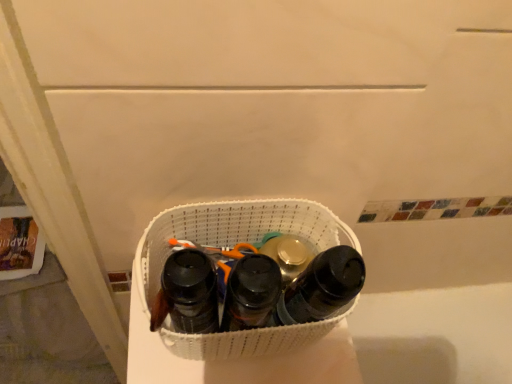
In order to face black matte water bottle at center, the 3th footwear positioned from the right, should I rotate leftwards or rightwards?

A 8.080 degree turn to the left will do.

Find the location of `black matte bottle at center, the first footwear in the right-to-left sequence`. black matte bottle at center, the first footwear in the right-to-left sequence is located at coordinates (322, 287).

How many degrees apart are the facing directions of white woven laundry basket at center and black matte water bottle at center, the first footwear when ordered from left to right?

The angle between the facing direction of white woven laundry basket at center and the facing direction of black matte water bottle at center, the first footwear when ordered from left to right, is 0.00305 degrees.

Does white woven laundry basket at center have a greater width compared to black matte water bottle at center, the first footwear when ordered from left to right?

Yes.

Is point (214, 351) in front of point (205, 298)?

No, it is not.

Is white woven laundry basket at center far from black matte water bottle at center, the 3th footwear positioned from the right?

No, white woven laundry basket at center is not far away from black matte water bottle at center, the 3th footwear positioned from the right.

Which point is more distant from viewer, (253, 274) or (328, 286)?

The point (328, 286) is more distant.

Is black matte shoe at center, the 2th footwear viewed from the right, looking in the opposite direction of black matte bottle at center, the first footwear in the right-to-left sequence?

No, black matte bottle at center, the first footwear in the right-to-left sequence, is not at the back of black matte shoe at center, the 2th footwear viewed from the right.

Where is `footwear that is the 2nd one when counting upward from the black matte shoe at center, which is the second footwear in left-to-right order (from the image's perspective)`? footwear that is the 2nd one when counting upward from the black matte shoe at center, which is the second footwear in left-to-right order (from the image's perspective) is located at coordinates (322, 287).

Which object is thinner, black matte shoe at center, which is the second footwear in left-to-right order, or black matte bottle at center, which is the 3th footwear from left to right?

With smaller width is black matte bottle at center, which is the 3th footwear from left to right.

Is black matte water bottle at center, the first footwear when ordered from left to right, bigger or smaller than white woven laundry basket at center?

black matte water bottle at center, the first footwear when ordered from left to right, is smaller than white woven laundry basket at center.

Is black matte water bottle at center, the 3th footwear positioned from the right, in front of or behind white woven laundry basket at center in the image?

In the image, black matte water bottle at center, the 3th footwear positioned from the right, appears in front of white woven laundry basket at center.

From a real-world perspective, starting from the white woven laundry basket at center, which footwear is the 1st one vertically above it? Please provide its 2D coordinates.

[(190, 292)]

From the image's perspective, is black matte water bottle at center, the 3th footwear positioned from the right, above white woven laundry basket at center?

No, from the image's perspective, black matte water bottle at center, the 3th footwear positioned from the right, is not above white woven laundry basket at center.

Is black matte water bottle at center, the 3th footwear positioned from the right, completely or partially outside of black matte shoe at center, which is the second footwear in left-to-right order?

That's correct, black matte water bottle at center, the 3th footwear positioned from the right, is outside of black matte shoe at center, which is the second footwear in left-to-right order.

This screenshot has width=512, height=384. Find the location of `the 1st footwear behind the black matte water bottle at center, the first footwear when ordered from left to right, starting your count from the anchor`. the 1st footwear behind the black matte water bottle at center, the first footwear when ordered from left to right, starting your count from the anchor is located at coordinates (251, 292).

Which is further, (168, 257) or (261, 287)?

The point (168, 257) is more distant.

Considering the sizes of objects black matte water bottle at center, the first footwear when ordered from left to right, and black matte shoe at center, the 2th footwear viewed from the right, in the image provided, who is bigger, black matte water bottle at center, the first footwear when ordered from left to right, or black matte shoe at center, the 2th footwear viewed from the right,?

With larger size is black matte shoe at center, the 2th footwear viewed from the right.

Where is `footwear that is the 2nd object located in front of the white woven laundry basket at center`? footwear that is the 2nd object located in front of the white woven laundry basket at center is located at coordinates (251, 292).

Considering the relative sizes of white woven laundry basket at center and black matte shoe at center, the 2th footwear viewed from the right, in the image provided, is white woven laundry basket at center shorter than black matte shoe at center, the 2th footwear viewed from the right,?

Correct, white woven laundry basket at center is not as tall as black matte shoe at center, the 2th footwear viewed from the right.

From the image's perspective, relative to black matte shoe at center, which is the second footwear in left-to-right order, is white woven laundry basket at center above or below?

white woven laundry basket at center is situated higher than black matte shoe at center, which is the second footwear in left-to-right order, in the image.

Between white woven laundry basket at center and black matte shoe at center, which is the second footwear in left-to-right order, which one appears on the right side from the viewer's perspective?

black matte shoe at center, which is the second footwear in left-to-right order.

Can you confirm if black matte shoe at center, the 2th footwear viewed from the right, is positioned to the right of black matte water bottle at center, the 3th footwear positioned from the right?

Correct, you'll find black matte shoe at center, the 2th footwear viewed from the right, to the right of black matte water bottle at center, the 3th footwear positioned from the right.

From the picture: Is black matte shoe at center, which is the second footwear in left-to-right order, oriented towards black matte water bottle at center, the 3th footwear positioned from the right?

No, black matte shoe at center, which is the second footwear in left-to-right order, is not oriented towards black matte water bottle at center, the 3th footwear positioned from the right.

In the scene shown: Is black matte bottle at center, which is the 3th footwear from left to right, turned away from black matte shoe at center, which is the second footwear in left-to-right order?

No, black matte bottle at center, which is the 3th footwear from left to right,'s orientation is not away from black matte shoe at center, which is the second footwear in left-to-right order.

How distant is black matte bottle at center, which is the 3th footwear from left to right, from black matte shoe at center, which is the second footwear in left-to-right order?

black matte bottle at center, which is the 3th footwear from left to right, and black matte shoe at center, which is the second footwear in left-to-right order, are 4.84 centimeters apart.

Is point (345, 291) positioned behind point (265, 288)?

Yes, point (345, 291) is behind point (265, 288).

Based on the photo, visually, is black matte bottle at center, the first footwear in the right-to-left sequence, positioned to the left or to the right of black matte shoe at center, which is the second footwear in left-to-right order?

black matte bottle at center, the first footwear in the right-to-left sequence, is to the right of black matte shoe at center, which is the second footwear in left-to-right order.

Identify the location of the 3rd footwear in front of the white woven laundry basket at center, counting from the anchor's position. The width and height of the screenshot is (512, 384). (190, 292).

From the image's perspective, count 2nd footwears upward from the black matte shoe at center, the 2th footwear viewed from the right, and point to it. Please provide its 2D coordinates.

[(322, 287)]

Looking at the image, which one is located closer to black matte water bottle at center, the 3th footwear positioned from the right, white woven laundry basket at center or black matte shoe at center, which is the second footwear in left-to-right order?

black matte shoe at center, which is the second footwear in left-to-right order.

Based on their spatial positions, is black matte bottle at center, which is the 3th footwear from left to right, or white woven laundry basket at center further from black matte water bottle at center, the 3th footwear positioned from the right?

The object further to black matte water bottle at center, the 3th footwear positioned from the right, is black matte bottle at center, which is the 3th footwear from left to right.

Looking at the image, which one is located further to black matte bottle at center, the first footwear in the right-to-left sequence, black matte water bottle at center, the first footwear when ordered from left to right, or black matte shoe at center, which is the second footwear in left-to-right order?

black matte water bottle at center, the first footwear when ordered from left to right, lies further to black matte bottle at center, the first footwear in the right-to-left sequence, than the other object.

From the image, which object appears to be nearer to black matte water bottle at center, the 3th footwear positioned from the right, black matte shoe at center, the 2th footwear viewed from the right, or white woven laundry basket at center?

Based on the image, black matte shoe at center, the 2th footwear viewed from the right, appears to be nearer to black matte water bottle at center, the 3th footwear positioned from the right.

Looking at the image, which one is located closer to white woven laundry basket at center, black matte shoe at center, which is the second footwear in left-to-right order, or black matte bottle at center, the first footwear in the right-to-left sequence?

Among the two, black matte bottle at center, the first footwear in the right-to-left sequence, is located nearer to white woven laundry basket at center.

From the image, which object appears to be farther from black matte bottle at center, which is the 3th footwear from left to right, black matte water bottle at center, the 3th footwear positioned from the right, or white woven laundry basket at center?

black matte water bottle at center, the 3th footwear positioned from the right, is positioned further to the anchor black matte bottle at center, which is the 3th footwear from left to right.

When comparing their distances from white woven laundry basket at center, does black matte water bottle at center, the first footwear when ordered from left to right, or black matte bottle at center, the first footwear in the right-to-left sequence, seem further?

Among the two, black matte bottle at center, the first footwear in the right-to-left sequence, is located further to white woven laundry basket at center.

From the image, which object appears to be nearer to white woven laundry basket at center, black matte water bottle at center, the 3th footwear positioned from the right, or black matte shoe at center, the 2th footwear viewed from the right?

Among the two, black matte water bottle at center, the 3th footwear positioned from the right, is located nearer to white woven laundry basket at center.

Where is `laundry basket between black matte water bottle at center, the first footwear when ordered from left to right, and black matte bottle at center, the first footwear in the right-to-left sequence, in the horizontal direction`? The image size is (512, 384). laundry basket between black matte water bottle at center, the first footwear when ordered from left to right, and black matte bottle at center, the first footwear in the right-to-left sequence, in the horizontal direction is located at coordinates (231, 231).

The image size is (512, 384). Find the location of `footwear located between black matte water bottle at center, the 3th footwear positioned from the right, and black matte bottle at center, which is the 3th footwear from left to right, in the left-right direction`. footwear located between black matte water bottle at center, the 3th footwear positioned from the right, and black matte bottle at center, which is the 3th footwear from left to right, in the left-right direction is located at coordinates (251, 292).

Where is `footwear situated between white woven laundry basket at center and black matte bottle at center, which is the 3th footwear from left to right, from left to right`? Image resolution: width=512 pixels, height=384 pixels. footwear situated between white woven laundry basket at center and black matte bottle at center, which is the 3th footwear from left to right, from left to right is located at coordinates (251, 292).

I want to click on laundry basket between black matte water bottle at center, the 3th footwear positioned from the right, and black matte shoe at center, the 2th footwear viewed from the right, in the horizontal direction, so click(231, 231).